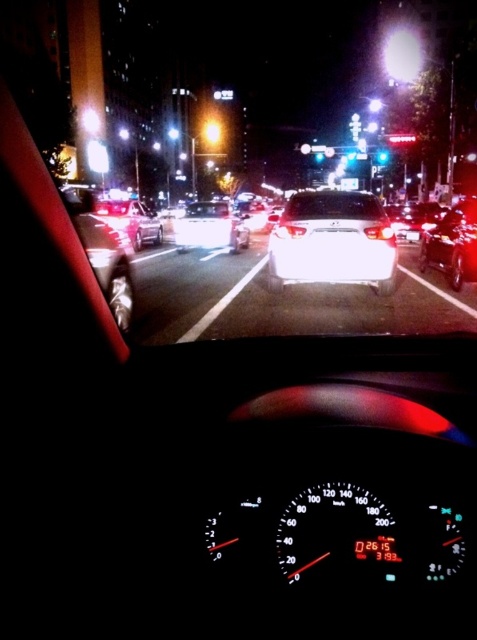
You are sitting in the driver seat of the car and see two points marked on the windshield. The first point is at coordinates point (123, 208) and the second point is at point (317, 154). Which point is closer to you?

Point (123, 208) is closer to the viewer than point (317, 154).

You are a passenger in the car and looking out the window. You see a white glossy sedan at center and a shiny silver sedan at left. Which one is closer to the right side of the road?

The white glossy sedan at center is closer to the right side of the road because it is positioned to the right of the shiny silver sedan at left.

You are driving at night and see a shiny silver sedan at left and a green glass traffic light at center. Which object appears larger in the image?

The shiny silver sedan at left appears larger than the green glass traffic light at center in the image.